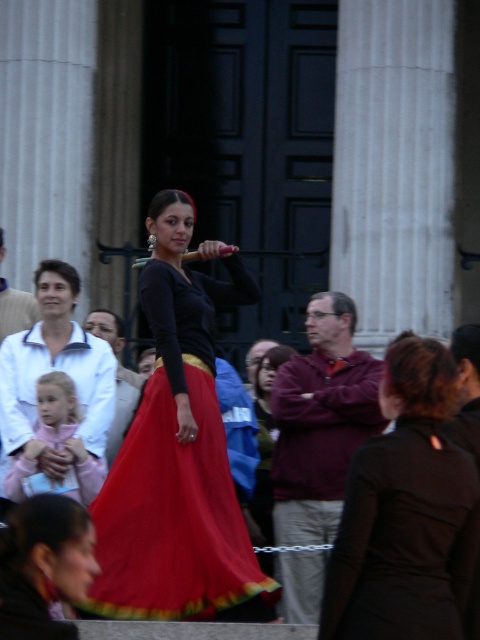
Between matte white jacket at left and matte pink dress at lower left, which one appears on the left side from the viewer's perspective?

From the viewer's perspective, matte pink dress at lower left appears more on the left side.

Who is shorter, matte white jacket at left or matte pink dress at lower left?

With less height is matte white jacket at left.

Is point (52, 300) positioned behind point (58, 387)?

Yes, point (52, 300) is behind point (58, 387).

Image resolution: width=480 pixels, height=640 pixels. I want to click on matte white jacket at left, so click(x=54, y=365).

How distant is black fabric skirt at center from maroon fleece jacket at center?

The distance of black fabric skirt at center from maroon fleece jacket at center is 13.39 meters.

Is point (451, 467) positioned after point (339, 321)?

No.

Where is `black fabric skirt at center`? The height and width of the screenshot is (640, 480). black fabric skirt at center is located at coordinates (406, 513).

Is matte black top at center thinner than maroon fleece jacket at center?

Incorrect, matte black top at center's width is not less than maroon fleece jacket at center's.

Which is below, matte black top at center or maroon fleece jacket at center?

maroon fleece jacket at center is below.

Which is behind, point (206, 298) or point (337, 476)?

The point (337, 476) is behind.

In order to click on matte black top at center in this screenshot , I will do `click(178, 456)`.